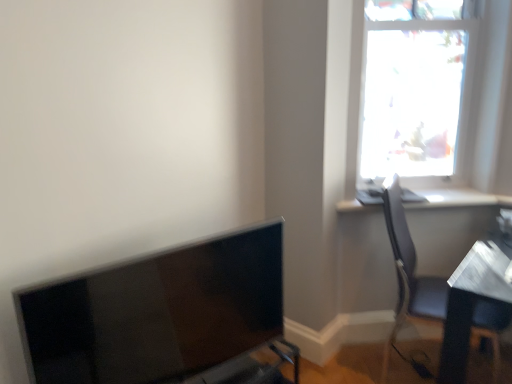
In order to click on transparent glass window at upper right in this screenshot , I will do `click(411, 97)`.

Describe the element at coordinates (458, 198) in the screenshot. I see `white glossy window sill at upper right` at that location.

Where is `matte gray chair at right`? matte gray chair at right is located at coordinates (409, 275).

Considering the relative sizes of transparent glass window at upper right and matte gray chair at right in the image provided, is transparent glass window at upper right smaller than matte gray chair at right?

Indeed, transparent glass window at upper right has a smaller size compared to matte gray chair at right.

The width and height of the screenshot is (512, 384). Find the location of `window on the left of matte gray chair at right`. window on the left of matte gray chair at right is located at coordinates (411, 97).

From a real-world perspective, relative to matte gray chair at right, is transparent glass window at upper right vertically above or below?

Clearly, from a real-world perspective, transparent glass window at upper right is above matte gray chair at right.

Can you confirm if transparent glass window at upper right is positioned to the right of matte gray chair at right?

No.

From the image's perspective, is matte black monitor at lower left beneath matte gray chair at right?

Yes, from the image's perspective, matte black monitor at lower left is below matte gray chair at right.

Which is correct: matte black monitor at lower left is inside matte gray chair at right, or outside of it?

matte black monitor at lower left exists outside the volume of matte gray chair at right.

Which object is thinner, matte black monitor at lower left or matte gray chair at right?

With smaller width is matte black monitor at lower left.

Considering the relative positions of matte black monitor at lower left and matte gray chair at right in the image provided, is matte black monitor at lower left to the left or to the right of matte gray chair at right?

Based on their positions, matte black monitor at lower left is located to the left of matte gray chair at right.

Is transparent glass window at upper right oriented towards matte black monitor at lower left?

No, transparent glass window at upper right does not turn towards matte black monitor at lower left.

Does transparent glass window at upper right lie behind matte black monitor at lower left?

Yes, the depth of transparent glass window at upper right is greater than that of matte black monitor at lower left.

Is matte black monitor at lower left completely or partially inside transparent glass window at upper right?

No, matte black monitor at lower left is not inside transparent glass window at upper right.

From the image's perspective, is matte gray chair at right located beneath white glossy window sill at upper right?

Yes.

Is matte gray chair at right next to white glossy window sill at upper right?

There is a gap between matte gray chair at right and white glossy window sill at upper right.

Is matte gray chair at right looking in the opposite direction of white glossy window sill at upper right?

No, matte gray chair at right is not facing the opposite direction of white glossy window sill at upper right.

From a real-world perspective, is matte gray chair at right positioned above or below white glossy window sill at upper right?

Clearly, from a real-world perspective, matte gray chair at right is below white glossy window sill at upper right.

How many degrees apart are the facing directions of matte gray chair at right and transparent glass window at upper right?

There is a 57.7-degree angle between the facing directions of matte gray chair at right and transparent glass window at upper right.

Between matte gray chair at right and transparent glass window at upper right, which one is positioned behind?

transparent glass window at upper right is further away from the camera.

In the scene shown: Is matte gray chair at right placed right next to transparent glass window at upper right?

No, matte gray chair at right is not next to transparent glass window at upper right.

Is matte gray chair at right positioned with its back to transparent glass window at upper right?

matte gray chair at right is not turned away from transparent glass window at upper right.

Does white glossy window sill at upper right appear on the right side of matte gray chair at right?

No, white glossy window sill at upper right is not to the right of matte gray chair at right.

Is the depth of white glossy window sill at upper right less than that of matte gray chair at right?

No, white glossy window sill at upper right is behind matte gray chair at right.

Looking at this image, from a real-world perspective, is white glossy window sill at upper right physically located above or below matte gray chair at right?

Clearly, from a real-world perspective, white glossy window sill at upper right is above matte gray chair at right.

Is white glossy window sill at upper right aimed at matte gray chair at right?

Yes, white glossy window sill at upper right is aimed at matte gray chair at right.

From a real-world perspective, is matte gray chair at right located higher than matte black monitor at lower left?

Incorrect, from a real-world perspective, matte gray chair at right is lower than matte black monitor at lower left.

Considering the sizes of objects matte gray chair at right and matte black monitor at lower left in the image provided, who is thinner, matte gray chair at right or matte black monitor at lower left?

With smaller width is matte black monitor at lower left.

Could you tell me if matte gray chair at right is facing matte black monitor at lower left?

No.

Is matte gray chair at right in contact with matte black monitor at lower left?

matte gray chair at right is not next to matte black monitor at lower left, and they're not touching.

Where is `window that is behind the matte gray chair at right`? Image resolution: width=512 pixels, height=384 pixels. window that is behind the matte gray chair at right is located at coordinates (411, 97).

Find the location of a particular element. Image resolution: width=512 pixels, height=384 pixels. chair that is under the matte black monitor at lower left (from a real-world perspective) is located at coordinates (409, 275).

From the image, which object appears to be nearer to white glossy window sill at upper right, matte black monitor at lower left or transparent glass window at upper right?

transparent glass window at upper right.

Considering their positions, is white glossy window sill at upper right positioned further to transparent glass window at upper right than matte gray chair at right?

white glossy window sill at upper right lies further to transparent glass window at upper right than the other object.

Considering their positions, is matte black monitor at lower left positioned further to transparent glass window at upper right than matte gray chair at right?

matte black monitor at lower left is further to transparent glass window at upper right.

Based on the photo, which object lies nearer to the anchor point matte gray chair at right, matte black monitor at lower left or transparent glass window at upper right?

transparent glass window at upper right is positioned closer to the anchor matte gray chair at right.

Which object lies nearer to the anchor point transparent glass window at upper right, white glossy window sill at upper right or matte black monitor at lower left?

white glossy window sill at upper right lies closer to transparent glass window at upper right than the other object.

Looking at the image, which one is located further to white glossy window sill at upper right, matte gray chair at right or transparent glass window at upper right?

The object further to white glossy window sill at upper right is transparent glass window at upper right.

From the image, which object appears to be nearer to matte gray chair at right, matte black monitor at lower left or white glossy window sill at upper right?

Among the two, white glossy window sill at upper right is located nearer to matte gray chair at right.

When comparing their distances from matte black monitor at lower left, does white glossy window sill at upper right or transparent glass window at upper right seem closer?

Among the two, white glossy window sill at upper right is located nearer to matte black monitor at lower left.

Identify the location of window sill between matte black monitor at lower left and matte gray chair at right in the horizontal direction. The image size is (512, 384). (458, 198).

The height and width of the screenshot is (384, 512). Identify the location of window sill that lies between transparent glass window at upper right and matte gray chair at right from top to bottom. (458, 198).

Find the location of a particular element. The height and width of the screenshot is (384, 512). window sill between matte black monitor at lower left and transparent glass window at upper right in the horizontal direction is located at coordinates (458, 198).

In order to click on window located between matte black monitor at lower left and matte gray chair at right in the left-right direction in this screenshot , I will do `click(411, 97)`.